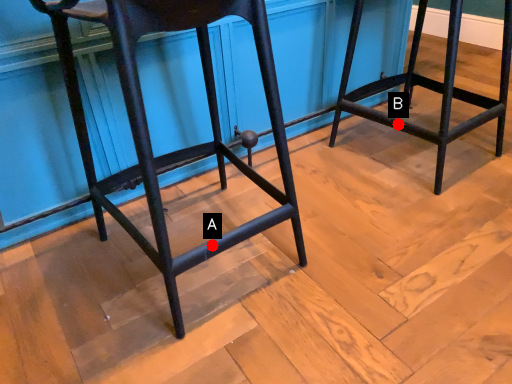
Question: Two points are circled on the image, labeled by A and B beside each circle. Which point appears closest to the camera in this image?

Choices:
 (A) A is closer
 (B) B is closer

Answer: (A)